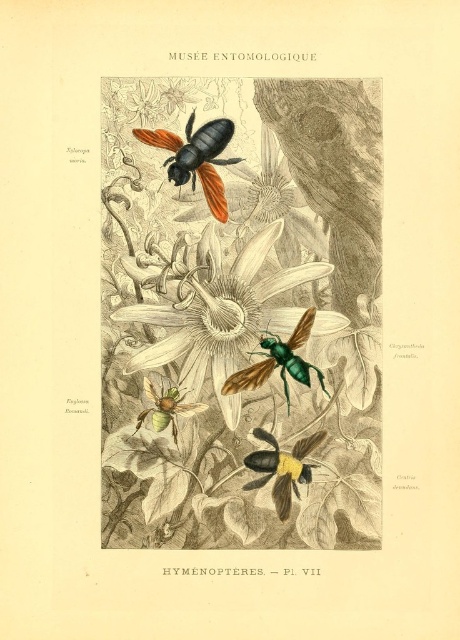
Question: Which point is closer to the camera?

Choices:
 (A) (168, 134)
 (B) (283, 378)
 (C) (270, 472)

Answer: (A)

Question: Can you confirm if matte black bee at upper center is thinner than metallic green bee at center?

Choices:
 (A) yes
 (B) no

Answer: (B)

Question: Is shiny black beetle at upper center positioned before yellow-brown fuzzy bee at center?

Choices:
 (A) no
 (B) yes

Answer: (B)

Question: Is matte black bee at upper center to the left of green glossy flower at center from the viewer's perspective?

Choices:
 (A) no
 (B) yes

Answer: (A)

Question: Which point is farther to the camera?

Choices:
 (A) green glossy flower at center
 (B) yellow-brown fuzzy bee at center

Answer: (A)

Question: Which of these objects is positioned closest to the metallic green bee at center?

Choices:
 (A) green glossy flower at center
 (B) green matte bee at center

Answer: (A)